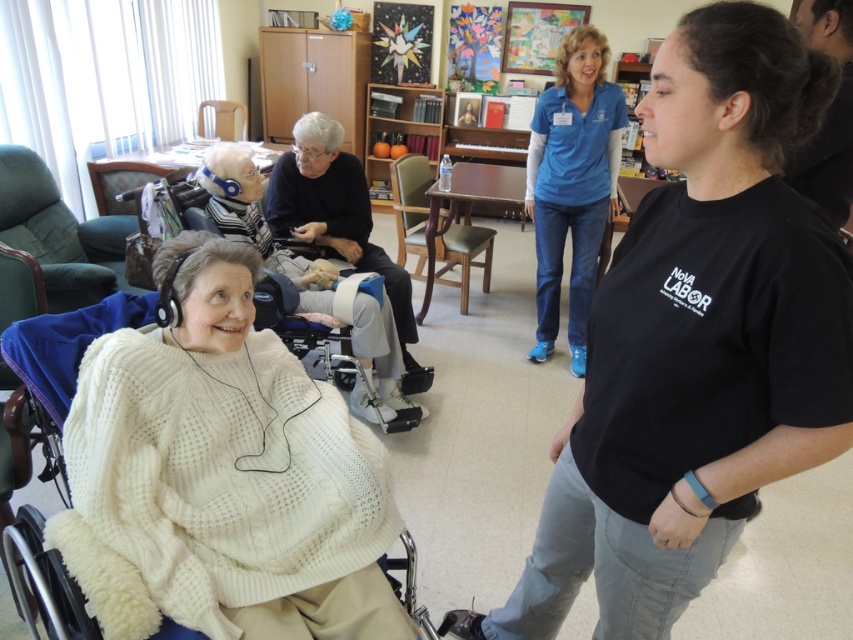
Identify the location of black fabric chair at center. (334, 211).

Measure the distance between black fabric chair at center and camera.

The distance of black fabric chair at center from camera is 3.06 meters.

Image resolution: width=853 pixels, height=640 pixels. Identify the location of black fabric chair at center. (334, 211).

Is point (256, 572) more distant than point (172, 204)?

No.

Is white cable-knit sweater at center thinner than white knitted wheelchair at lower left?

Indeed, white cable-knit sweater at center has a lesser width compared to white knitted wheelchair at lower left.

Between point (166, 432) and point (202, 221), which one is positioned behind?

The point (202, 221) is behind.

Image resolution: width=853 pixels, height=640 pixels. Find the location of `white cable-knit sweater at center`. white cable-knit sweater at center is located at coordinates (223, 476).

Does blue cotton shirt at center appear over black fabric chair at center?

Yes, blue cotton shirt at center is above black fabric chair at center.

Which is in front, point (619, 134) or point (363, 234)?

Point (619, 134) is more forward.

Find the location of `blue cotton shirt at center`. blue cotton shirt at center is located at coordinates (572, 182).